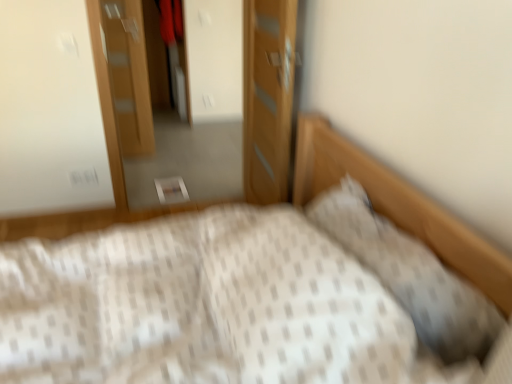
Question: Is white textured bed at center turned away from white textured pillow at upper right?

Choices:
 (A) no
 (B) yes

Answer: (B)

Question: Is white textured bed at center positioned behind white textured pillow at upper right?

Choices:
 (A) no
 (B) yes

Answer: (A)

Question: Is white textured bed at center closer to camera compared to white textured pillow at upper right?

Choices:
 (A) yes
 (B) no

Answer: (A)

Question: Does white textured bed at center have a greater height compared to white textured pillow at upper right?

Choices:
 (A) yes
 (B) no

Answer: (A)

Question: Can you confirm if white textured bed at center is thinner than white textured pillow at upper right?

Choices:
 (A) yes
 (B) no

Answer: (B)

Question: Is white textured bed at center to the left of white textured pillow at upper right from the viewer's perspective?

Choices:
 (A) no
 (B) yes

Answer: (B)

Question: From the image's perspective, does wooden door at center, which is the 2th door in back-to-front order, appear lower than white textured bed at center?

Choices:
 (A) yes
 (B) no

Answer: (B)

Question: From the image's perspective, would you say wooden door at center, which is the 2th door in back-to-front order, is positioned over white textured bed at center?

Choices:
 (A) yes
 (B) no

Answer: (A)

Question: Are wooden door at center, which ranks as the first door in right-to-left order, and white textured bed at center making contact?

Choices:
 (A) no
 (B) yes

Answer: (A)

Question: Considering the relative sizes of wooden door at center, which ranks as the first door in right-to-left order, and white textured bed at center in the image provided, is wooden door at center, which ranks as the first door in right-to-left order, wider than white textured bed at center?

Choices:
 (A) yes
 (B) no

Answer: (B)

Question: From a real-world perspective, is wooden door at center, the 2th door from the left, on white textured bed at center?

Choices:
 (A) no
 (B) yes

Answer: (B)

Question: Is wooden door at center, the 2th door from the left, at the right side of white textured bed at center?

Choices:
 (A) no
 (B) yes

Answer: (B)

Question: Considering the relative sizes of wooden dresser at center and white textured bed at center in the image provided, is wooden dresser at center shorter than white textured bed at center?

Choices:
 (A) no
 (B) yes

Answer: (A)